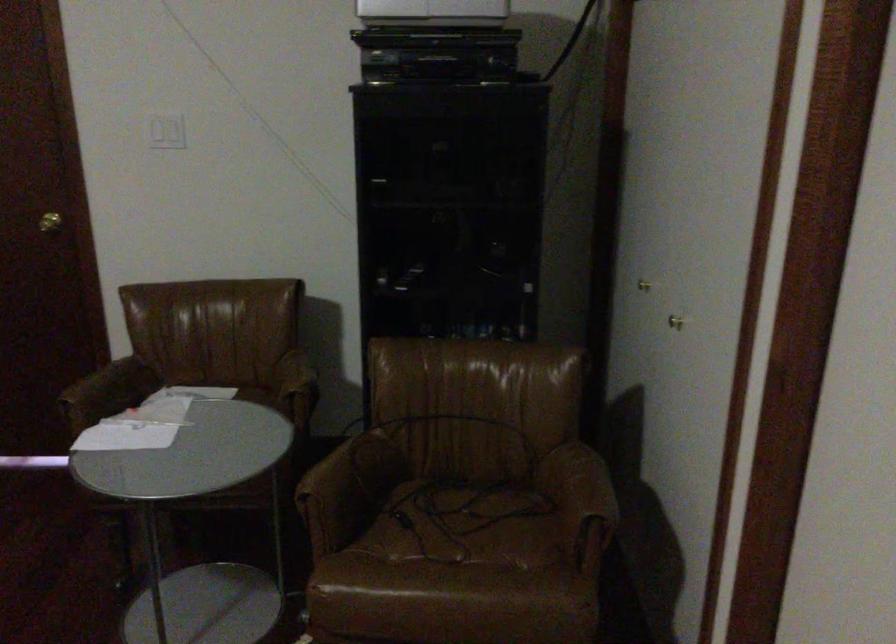
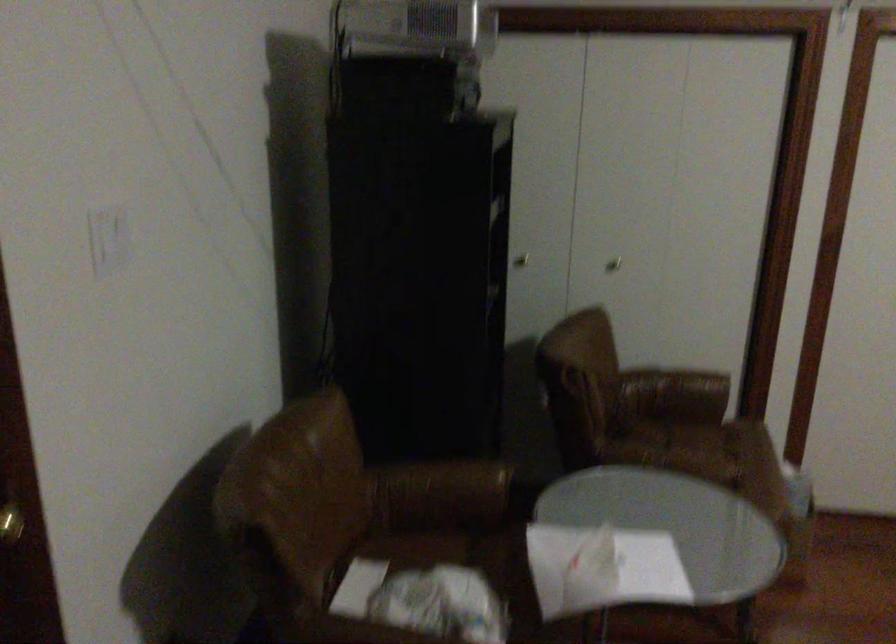
Find the pixel in the second image that matches (x=520, y=567) in the first image.

(718, 442)